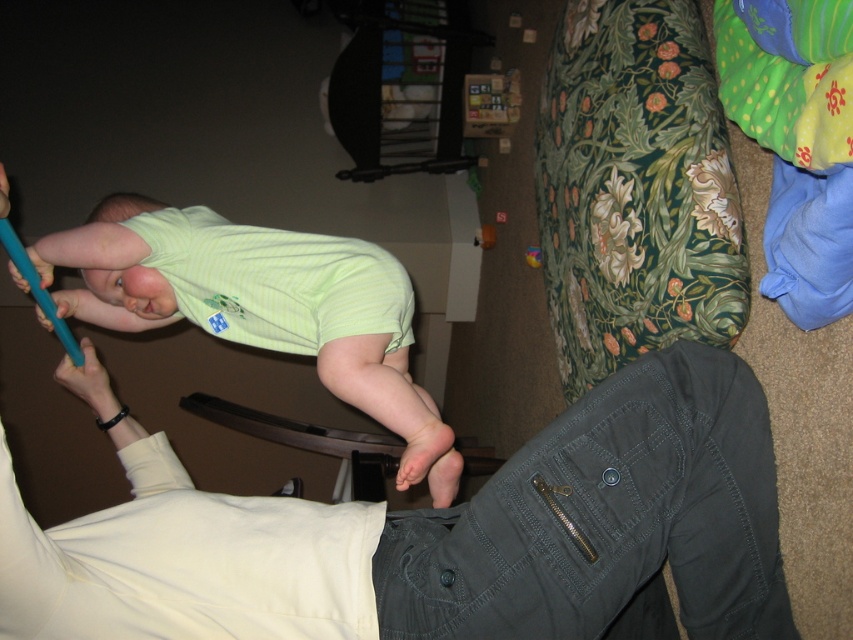
Question: In this image, where is light green fabric at upper left located relative to blue rubbery toy at upper left?

Choices:
 (A) left
 (B) right

Answer: (B)

Question: Which object is farther from the camera taking this photo?

Choices:
 (A) matte blue pen at lower left
 (B) dark gray pants at lower right
 (C) blue rubbery toy at upper left
 (D) pink smooth foot at lower center

Answer: (A)

Question: Can you confirm if blue rubber toy at upper left is positioned to the left of blue rubber finger at upper left?

Choices:
 (A) yes
 (B) no

Answer: (A)

Question: Considering the real-world distances, which object is closest to the pink matte flesh at center?

Choices:
 (A) matte blue pen at lower left
 (B) blue rubber toy at upper left
 (C) pink smooth foot at lower center
 (D) blue rubber finger at upper left

Answer: (A)

Question: Among these points, which one is nearest to the camera?

Choices:
 (A) (86, 362)
 (B) (456, 476)

Answer: (B)

Question: Is the position of dark gray pants at lower right more distant than that of matte blue pen at lower left?

Choices:
 (A) no
 (B) yes

Answer: (A)